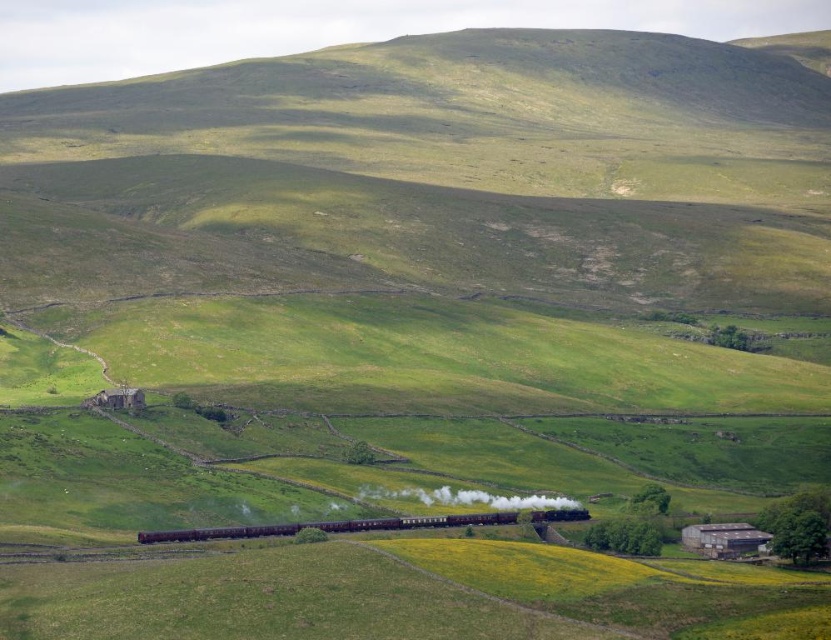
Question: Does polished dark brown train at center have a greater width compared to polished dark brown steam at center?

Choices:
 (A) no
 (B) yes

Answer: (B)

Question: Among these objects, which one is nearest to the camera?

Choices:
 (A) polished dark brown steam at center
 (B) polished dark brown train at center

Answer: (B)

Question: Which point is farther to the camera?

Choices:
 (A) (534, 497)
 (B) (256, 531)

Answer: (A)

Question: Can you confirm if polished dark brown train at center is positioned below polished dark brown steam at center?

Choices:
 (A) no
 (B) yes

Answer: (B)

Question: Does polished dark brown train at center lie behind polished dark brown steam at center?

Choices:
 (A) no
 (B) yes

Answer: (A)

Question: Among these objects, which one is nearest to the camera?

Choices:
 (A) polished dark brown train at center
 (B) polished dark brown steam at center

Answer: (A)